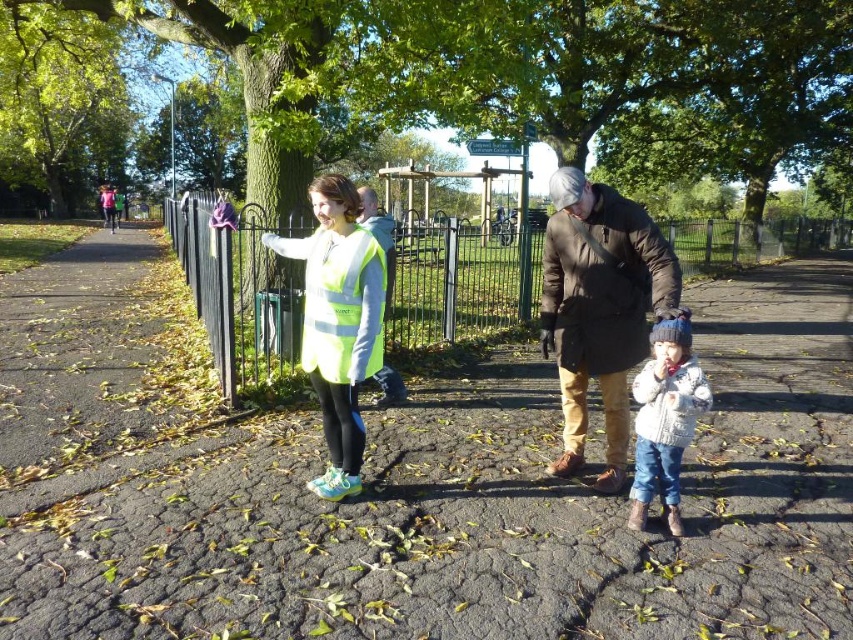
Which is more to the right, yellow reflective safety vest at center or reflective green vest at center?

reflective green vest at center is more to the right.

Is point (331, 381) in front of point (381, 387)?

Yes, it is.

The height and width of the screenshot is (640, 853). I want to click on yellow reflective safety vest at center, so click(x=341, y=305).

Can you confirm if green metal fence at center is bigger than dark brown leather jacket at center?

Yes, green metal fence at center is bigger than dark brown leather jacket at center.

Between point (469, 312) and point (608, 282), which one is positioned behind?

The point (469, 312) is behind.

Locate an element on the screen. green metal fence at center is located at coordinates (236, 294).

Between smooth asphalt path at center and dark brown leather jacket at center, which one is positioned higher?

dark brown leather jacket at center is higher up.

Based on the photo, can you confirm if smooth asphalt path at center is thinner than dark brown leather jacket at center?

Incorrect, smooth asphalt path at center's width is not less than dark brown leather jacket at center's.

Who is more forward, (33, 422) or (569, 349)?

Point (569, 349) is in front.

Locate an element on the screen. The width and height of the screenshot is (853, 640). smooth asphalt path at center is located at coordinates (418, 486).